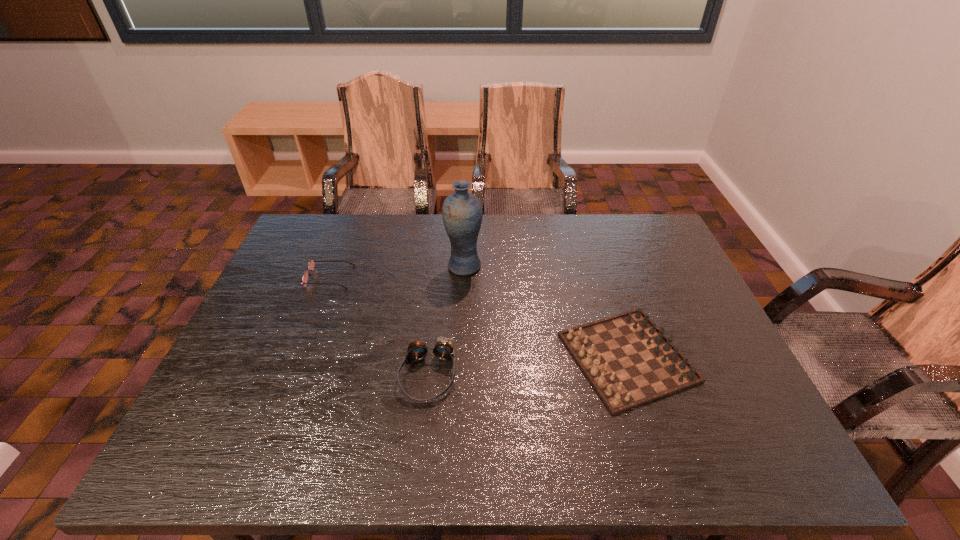
At what (x,y) coordinates should I click in order to perform the action: click on the tallest object. Please return your answer as a coordinate pair (x, y). Image resolution: width=960 pixels, height=540 pixels. Looking at the image, I should click on (462, 213).

The height and width of the screenshot is (540, 960). I want to click on goggles, so click(443, 350).

Image resolution: width=960 pixels, height=540 pixels. I want to click on chessboard, so click(x=629, y=361).

Where is `sunglasses`? The height and width of the screenshot is (540, 960). sunglasses is located at coordinates (311, 264).

Identify the location of the leftmost object. The height and width of the screenshot is (540, 960). (311, 264).

Locate an element on the screen. vacant space situated 0.210m on the back of the tallest object is located at coordinates (466, 217).

This screenshot has width=960, height=540. I want to click on blank space located 0.080m through the lenses of the goggles, so click(420, 438).

Image resolution: width=960 pixels, height=540 pixels. I want to click on vacant space located 0.330m on the back of the chessboard, so click(589, 238).

In order to click on free space located on the bridge of the shortest object in this screenshot , I will do `click(434, 277)`.

What are the coordinates of `object located in the far edge section of the desktop` in the screenshot? It's located at (462, 213).